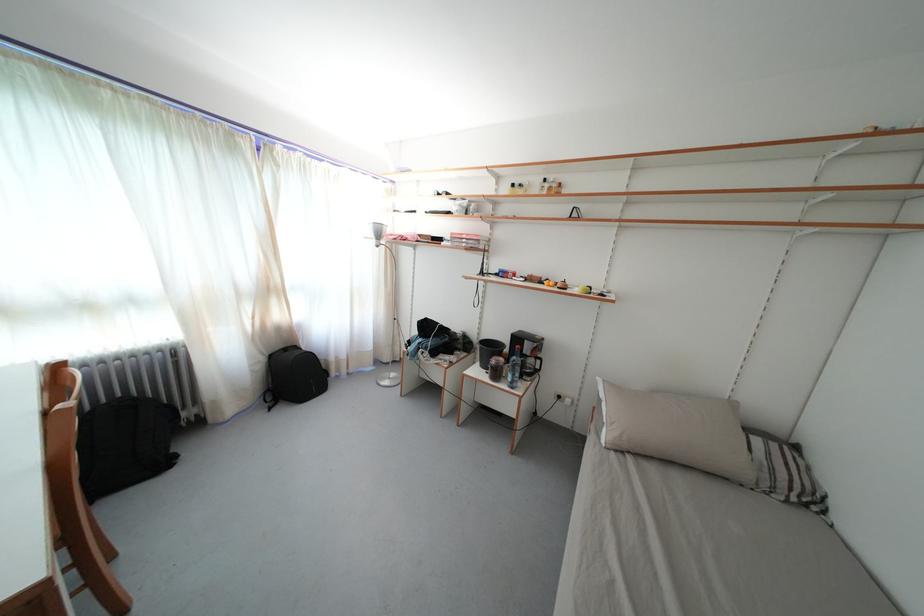
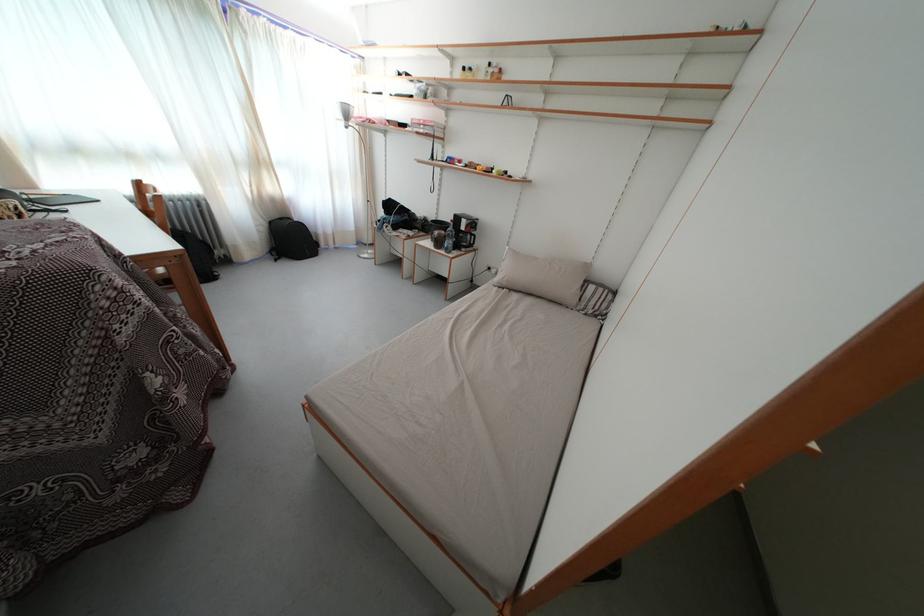
Locate, in the second image, the point that corresponds to (270,365) in the first image.

(272, 230)